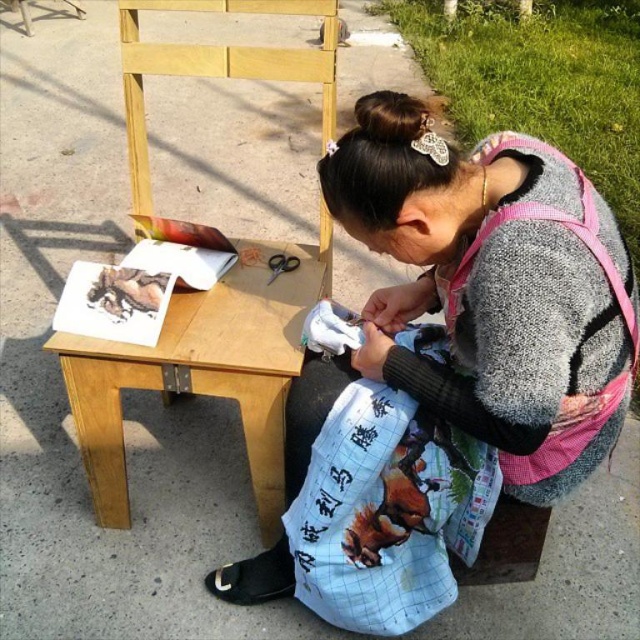
Is point (422, 442) farther from viewer compared to point (243, 307)?

No, it is not.

Who is more distant from viewer, (326, 332) or (150, 364)?

Point (150, 364)

What do you see at coordinates (387, 512) in the screenshot? I see `printed fabric tote bag at lower center` at bounding box center [387, 512].

This screenshot has width=640, height=640. Find the location of `printed fabric tote bag at lower center`. printed fabric tote bag at lower center is located at coordinates (387, 512).

Is white fabric bag at center taller than printed fabric tote bag at lower center?

Indeed, white fabric bag at center has a greater height compared to printed fabric tote bag at lower center.

Is white fabric bag at center above printed fabric tote bag at lower center?

Correct, white fabric bag at center is located above printed fabric tote bag at lower center.

Which is in front, point (451, 173) or point (424, 435)?

Point (451, 173)

Identify the location of white fabric bag at center. (481, 296).

Between point (545, 296) and point (284, 330), which one is positioned in front?

Point (545, 296)

Can you confirm if white fabric bag at center is bigger than wooden table at center?

Indeed, white fabric bag at center has a larger size compared to wooden table at center.

At what (x,y) coordinates should I click in order to perform the action: click on white fabric bag at center. Please return your answer as a coordinate pair (x, y). Looking at the image, I should click on (481, 296).